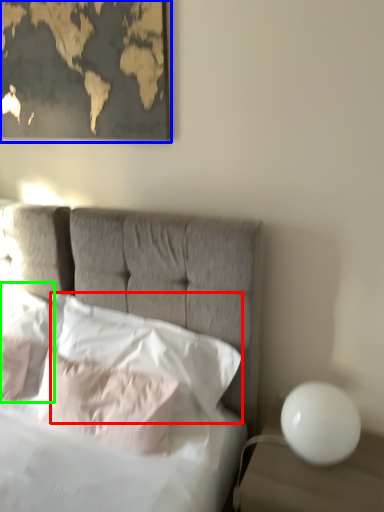
Question: Considering the real-world distances, which object is closest to pillow (highlighted by a red box)? picture frame (highlighted by a blue box) or pillow (highlighted by a green box).

Choices:
 (A) picture frame
 (B) pillow

Answer: (B)